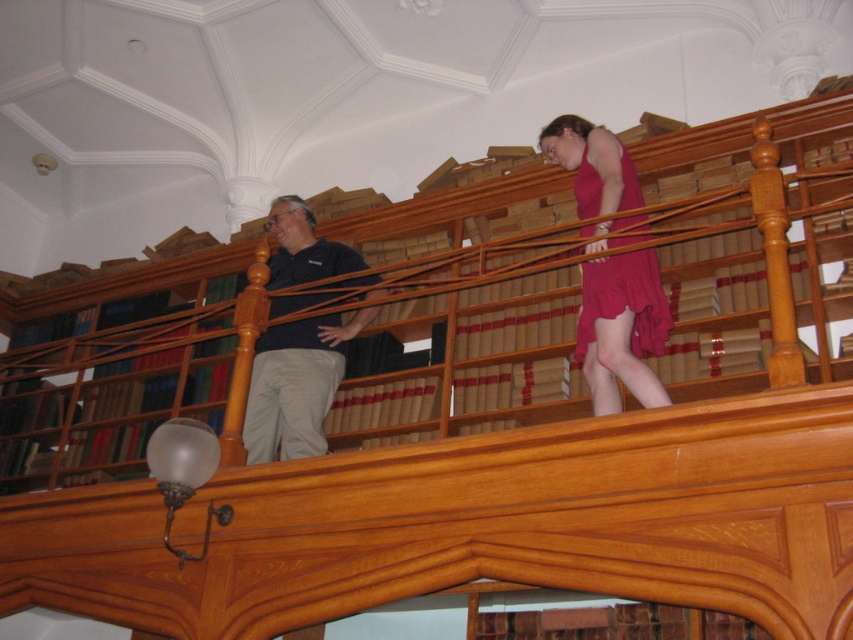
You are standing on the balcony and want to greet both the person in the black matte shirt at center and the person in the matte red dress at center. Which person should you approach first to reach them more quickly?

You should approach the person in the black matte shirt at center first because they are closer to you than the matte red dress at center, which is further away.

You are standing on the balcony of the library and want to place a small potted plant between the two points marked as point (x=520, y=401) and point (x=300, y=269). Which point should the plant be closer to in order to be nearer to the railing?

The plant should be placed closer to point (x=520, y=401) because it is closer to the viewer than point (x=300, y=269), implying it is nearer to the railing.

You are a delivery robot with a package that needs to be placed between the brown wood bookcase at upper center and the matte red dress at center. The package requires a minimum of 2 meters of space to be safely placed. Can you fit the package between them?

The brown wood bookcase at upper center and matte red dress at center are 2.16 meters apart from each other, which is more than the required 2 meters. Therefore, the package can be safely placed between them.